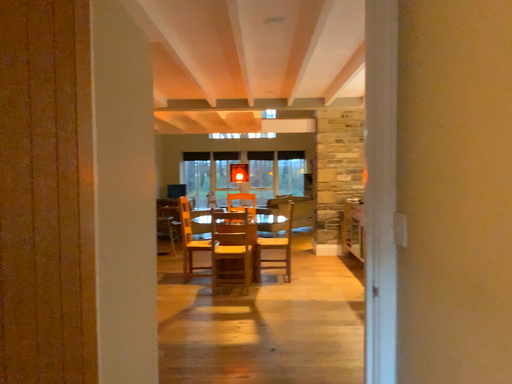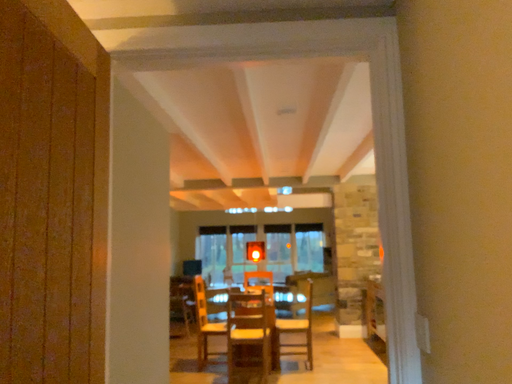
Question: How did the camera likely rotate when shooting the video?

Choices:
 (A) rotated downward
 (B) rotated upward

Answer: (B)